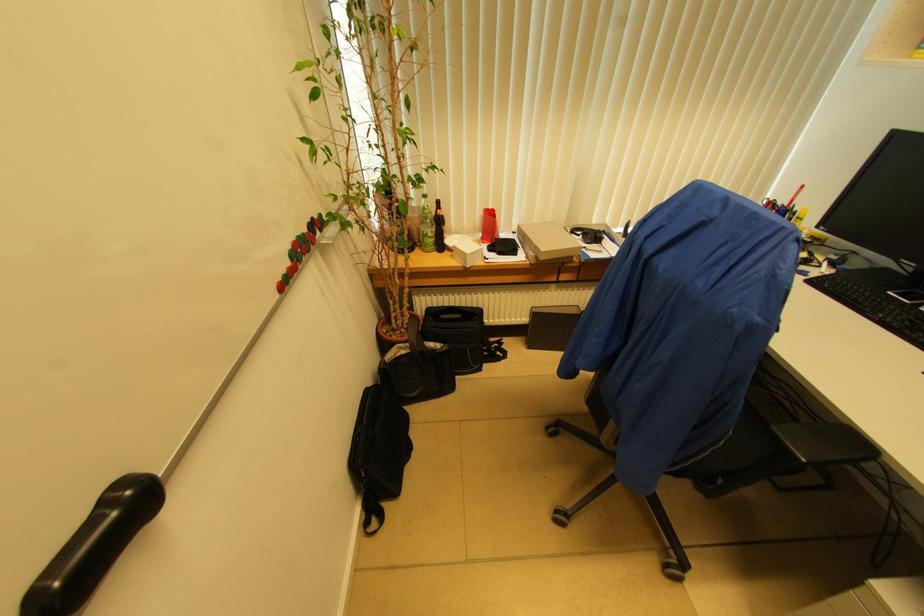
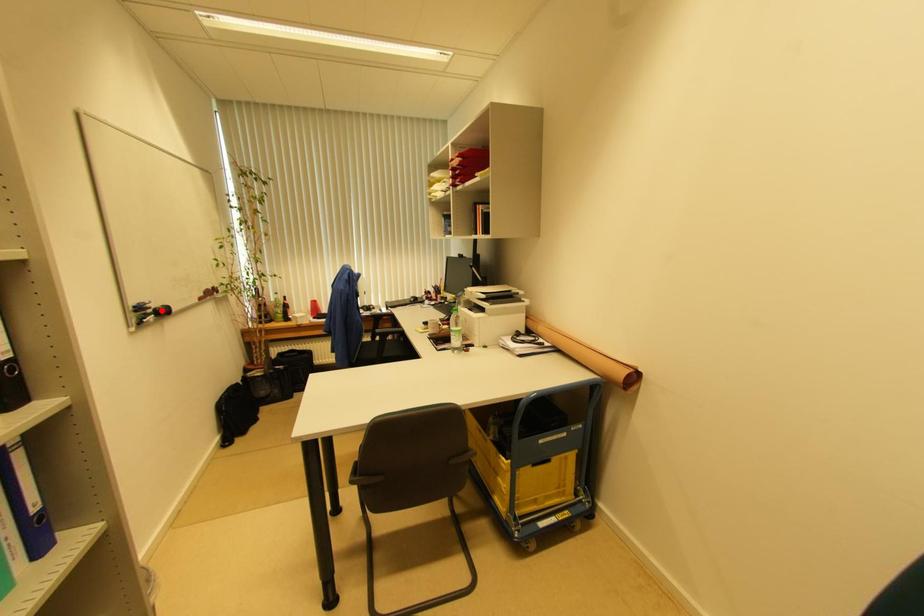
I am providing you with two images of the same scene from different viewpoints. A red point is marked on the first image and another point is marked on the second image. Is the red point in image1 aligned with the point shown in image2?

No